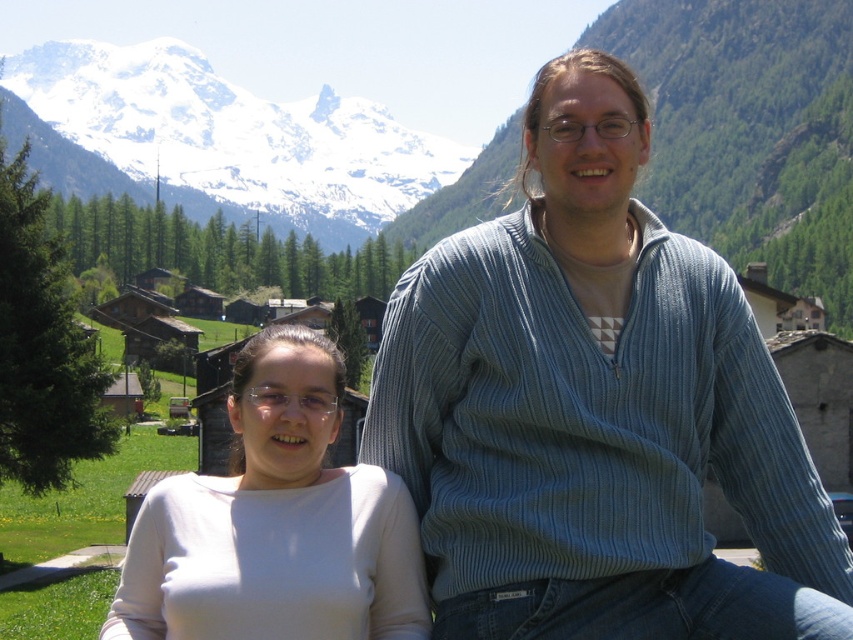
Question: Does blue striped sweater at center appear on the left side of white matte shirt at lower left?

Choices:
 (A) yes
 (B) no

Answer: (B)

Question: Among these objects, which one is nearest to the camera?

Choices:
 (A) blue striped sweater at center
 (B) white matte shirt at lower left

Answer: (A)

Question: Among these objects, which one is nearest to the camera?

Choices:
 (A) white matte shirt at lower left
 (B) snowy mountain at upper left

Answer: (A)

Question: Considering the relative positions of blue striped sweater at center and snowy mountain at upper left in the image provided, where is blue striped sweater at center located with respect to snowy mountain at upper left?

Choices:
 (A) right
 (B) left

Answer: (A)

Question: Is white matte shirt at lower left above snowy mountain at upper left?

Choices:
 (A) yes
 (B) no

Answer: (B)

Question: Which point is farther to the camera?

Choices:
 (A) (498, 637)
 (B) (218, 586)
 (C) (73, 54)

Answer: (C)